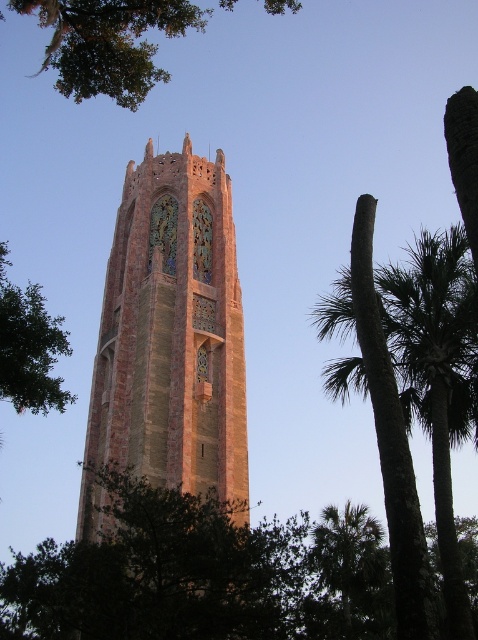
You are standing in the courtyard looking at the brick tower at center and the green leafy tree at upper left. Which object appears taller in the image?

The brick tower at center is much taller than the green leafy tree at upper left, so the brick tower at center appears taller in the image.

You are standing at the base of the tower and want to take a photo of the point labeled as point [132,307]. If your camera can focus on objects up to 60 meters away, will you be able to capture the point clearly?

The point labeled as point [132,307] is 66.51 meters away from the camera, which exceeds the camera focus limit of 60 meters. Therefore, the point cannot be captured clearly.

You are standing in front of the tower and want to determine which tree has a slimmer trunk between the green leafy palm tree at lower right and the green leafy tree at left. Based on the scene, which one is thinner?

The green leafy palm tree at lower right is thinner than the green leafy tree at left.